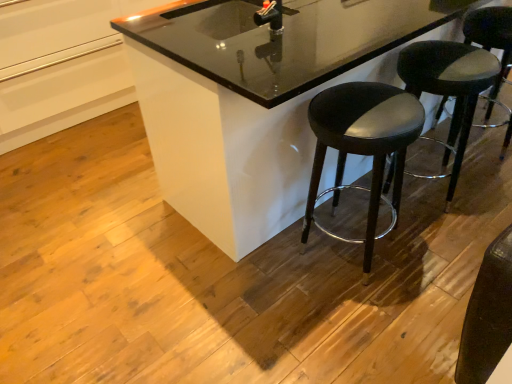
Question: Is black glossy counter at center at the back of black leather stool at center, the first stool in the left-to-right sequence?

Choices:
 (A) yes
 (B) no

Answer: (A)

Question: From the image's perspective, would you say black leather stool at center, the first stool in the left-to-right sequence, is shown under black glossy counter at center?

Choices:
 (A) yes
 (B) no

Answer: (A)

Question: Is black leather stool at center, the first stool in the left-to-right sequence, shorter than black glossy counter at center?

Choices:
 (A) no
 (B) yes

Answer: (B)

Question: Considering the relative positions of black leather stool at center, the first stool in the left-to-right sequence, and black glossy counter at center in the image provided, is black leather stool at center, the first stool in the left-to-right sequence, to the right of black glossy counter at center from the viewer's perspective?

Choices:
 (A) no
 (B) yes

Answer: (A)

Question: Does black leather stool at center, which is the 3th stool in right-to-left order, have a lesser width compared to black glossy counter at center?

Choices:
 (A) yes
 (B) no

Answer: (A)

Question: Considering the relative positions of black glossy sink at upper center and black leather stool at lower right, which is the 2th stool in left-to-right order, in the image provided, is black glossy sink at upper center to the left or to the right of black leather stool at lower right, which is the 2th stool in left-to-right order,?

Choices:
 (A) right
 (B) left

Answer: (B)

Question: From the image's perspective, is black glossy sink at upper center above or below black leather stool at lower right, which is the 2th stool in left-to-right order?

Choices:
 (A) above
 (B) below

Answer: (A)

Question: Is black glossy sink at upper center in front of or behind black leather stool at lower right, which is the second stool from right to left, in the image?

Choices:
 (A) front
 (B) behind

Answer: (A)

Question: Considering the positions of black glossy sink at upper center and black leather stool at lower right, which is the 2th stool in left-to-right order, in the image, is black glossy sink at upper center wider or thinner than black leather stool at lower right, which is the 2th stool in left-to-right order,?

Choices:
 (A) thin
 (B) wide

Answer: (A)

Question: In terms of size, does black glossy counter at center appear bigger or smaller than black leather stool at right, placed as the first stool when sorted from right to left?

Choices:
 (A) small
 (B) big

Answer: (B)

Question: Is black glossy counter at center inside or outside of black leather stool at right, placed as the first stool when sorted from right to left?

Choices:
 (A) inside
 (B) outside

Answer: (B)

Question: From the image's perspective, is black glossy counter at center positioned above or below black leather stool at right, which is counted as the 3th stool, starting from the left?

Choices:
 (A) below
 (B) above

Answer: (B)

Question: From a real-world perspective, is black glossy counter at center above or below black leather stool at right, placed as the first stool when sorted from right to left?

Choices:
 (A) below
 (B) above

Answer: (B)

Question: Is black leather stool at center, which is the 3th stool in right-to-left order, in front of or behind black glossy counter at center in the image?

Choices:
 (A) front
 (B) behind

Answer: (B)

Question: Would you say black leather stool at center, which is the 3th stool in right-to-left order, is to the left or to the right of black glossy counter at center in the picture?

Choices:
 (A) right
 (B) left

Answer: (B)